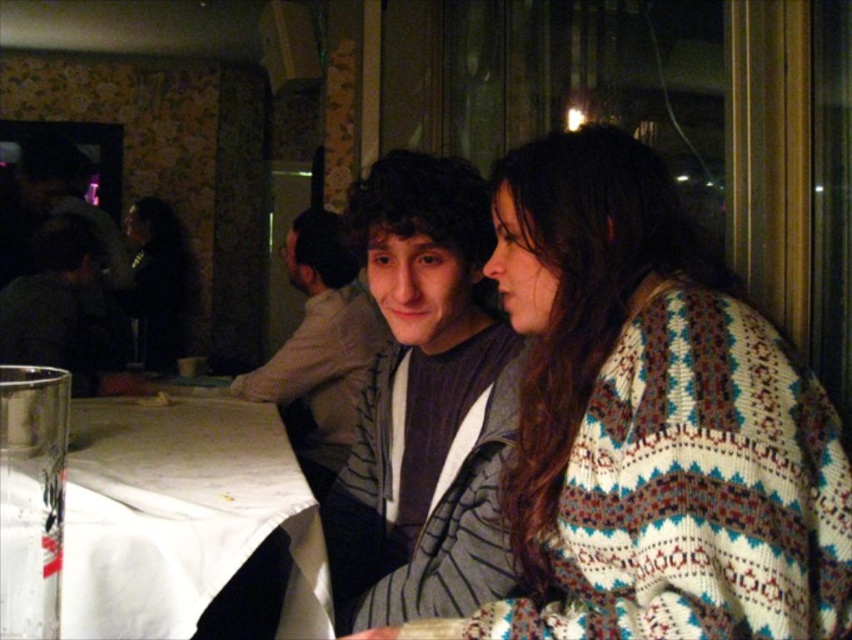
Which is behind, point (376, 502) or point (33, 432)?

The point (376, 502) is more distant.

The width and height of the screenshot is (852, 640). Describe the element at coordinates (426, 404) in the screenshot. I see `gray striped jacket at center` at that location.

Identify the location of gray striped jacket at center. The height and width of the screenshot is (640, 852). (426, 404).

You are a GUI agent. You are given a task and a screenshot of the screen. Output one action in this format:
    pyautogui.click(x=<x>, y=<y>)
    Task: Click on the gray striped jacket at center
    The image size is (852, 640).
    Given the screenshot: What is the action you would take?
    pyautogui.click(x=426, y=404)

Where is `white knitted sweater at center`? The height and width of the screenshot is (640, 852). white knitted sweater at center is located at coordinates (654, 420).

The image size is (852, 640). What do you see at coordinates (654, 420) in the screenshot?
I see `white knitted sweater at center` at bounding box center [654, 420].

The width and height of the screenshot is (852, 640). Describe the element at coordinates (654, 420) in the screenshot. I see `white knitted sweater at center` at that location.

You are a GUI agent. You are given a task and a screenshot of the screen. Output one action in this format:
    pyautogui.click(x=<x>, y=<y>)
    Task: Click on the white knitted sweater at center
    
    Given the screenshot: What is the action you would take?
    pyautogui.click(x=654, y=420)

Can you confirm if gray striped jacket at center is positioned to the left of gray striped shirt at center?

No, gray striped jacket at center is not to the left of gray striped shirt at center.

Locate an element on the screen. Image resolution: width=852 pixels, height=640 pixels. gray striped jacket at center is located at coordinates (426, 404).

You are a GUI agent. You are given a task and a screenshot of the screen. Output one action in this format:
    pyautogui.click(x=<x>, y=<y>)
    Task: Click on the gray striped jacket at center
    The image size is (852, 640).
    Given the screenshot: What is the action you would take?
    pyautogui.click(x=426, y=404)